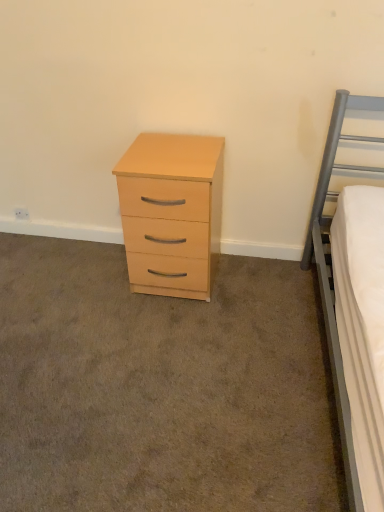
Question: From their relative heights in the image, would you say light wood/veneer chest of drawers at center is taller or shorter than light wood drawer at center?

Choices:
 (A) tall
 (B) short

Answer: (A)

Question: In the image, is light wood/veneer chest of drawers at center positioned in front of or behind light wood drawer at center?

Choices:
 (A) front
 (B) behind

Answer: (B)

Question: Does point (127, 178) appear closer or farther from the camera than point (258, 313)?

Choices:
 (A) farther
 (B) closer

Answer: (B)

Question: Is light wood drawer at center wider or thinner than light wood/veneer chest of drawers at center?

Choices:
 (A) wide
 (B) thin

Answer: (A)

Question: Is light wood drawer at center bigger or smaller than light wood/veneer chest of drawers at center?

Choices:
 (A) big
 (B) small

Answer: (B)

Question: Is light wood drawer at center in front of or behind light wood/veneer chest of drawers at center in the image?

Choices:
 (A) behind
 (B) front

Answer: (B)

Question: From their relative heights in the image, would you say light wood drawer at center is taller or shorter than light wood/veneer chest of drawers at center?

Choices:
 (A) short
 (B) tall

Answer: (A)